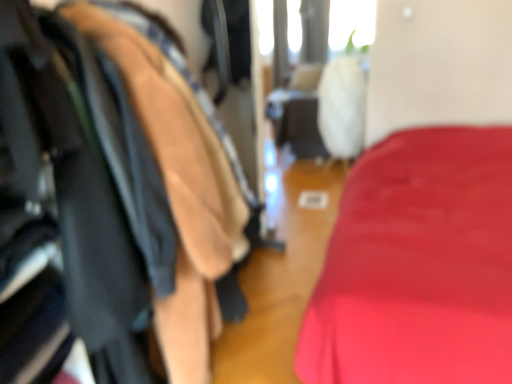
Question: Should I look upward or downward to see leather jacket at left?

Choices:
 (A) up
 (B) down

Answer: (B)